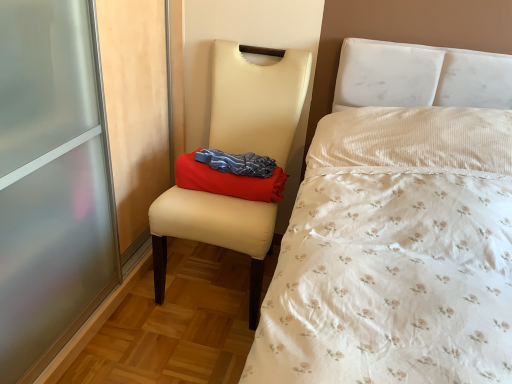
Question: From the image's perspective, relative to red fabric pillow at center, is matte cream chair at center above or below?

Choices:
 (A) below
 (B) above

Answer: (A)

Question: Considering the positions of point (248, 84) and point (238, 188), is point (248, 84) closer or farther from the camera than point (238, 188)?

Choices:
 (A) farther
 (B) closer

Answer: (A)

Question: Considering their positions, is matte cream chair at center located in front of or behind red fabric pillow at center?

Choices:
 (A) behind
 (B) front

Answer: (B)

Question: Is point (194, 175) closer or farther from the camera than point (216, 205)?

Choices:
 (A) closer
 (B) farther

Answer: (B)

Question: From their relative heights in the image, would you say red fabric pillow at center is taller or shorter than matte cream chair at center?

Choices:
 (A) tall
 (B) short

Answer: (B)

Question: In terms of size, does red fabric pillow at center appear bigger or smaller than matte cream chair at center?

Choices:
 (A) small
 (B) big

Answer: (A)

Question: From a real-world perspective, is red fabric pillow at center above or below matte cream chair at center?

Choices:
 (A) below
 (B) above

Answer: (B)